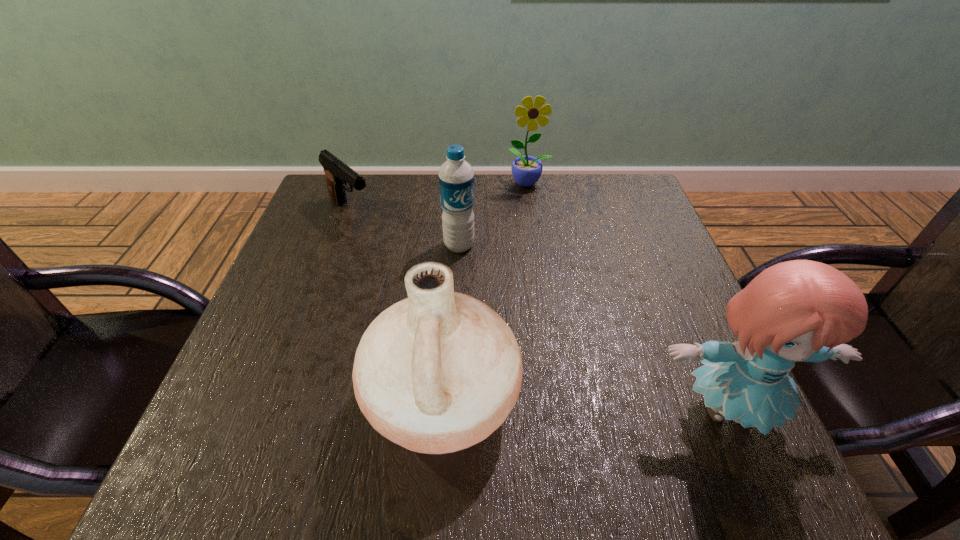
Locate an element on the screen. The width and height of the screenshot is (960, 540). free spot between the third nearest object and the sunflower is located at coordinates (494, 214).

Identify the location of vacant space in between the sunflower and the rightmost object. This screenshot has width=960, height=540. (628, 296).

The width and height of the screenshot is (960, 540). I want to click on object that stands as the closest to the water bottle, so click(337, 173).

Where is `object that is the closest one to the doll`? This screenshot has width=960, height=540. object that is the closest one to the doll is located at coordinates (437, 372).